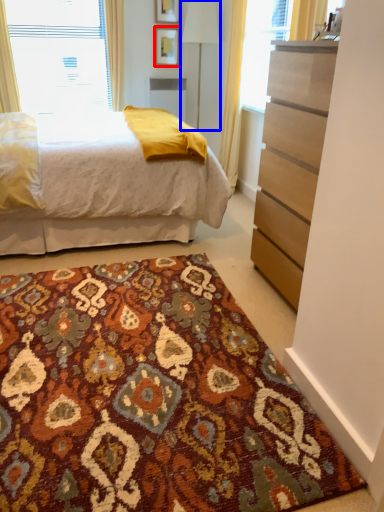
Question: Which object appears closest to the camera in this image, picture frame (highlighted by a red box) or table lamp (highlighted by a blue box)?

Choices:
 (A) picture frame
 (B) table lamp

Answer: (B)